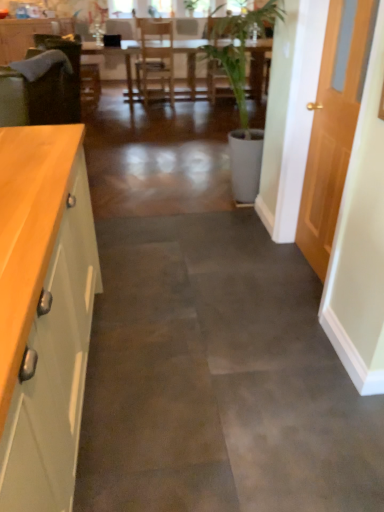
Describe the element at coordinates (117, 55) in the screenshot. This screenshot has height=512, width=384. I see `wooden table at center` at that location.

Find the location of `velvet green armchair at left`. velvet green armchair at left is located at coordinates (74, 70).

Locate an element on the screen. matte green cabinet at left, arranged as the first cabinetry when viewed from the back is located at coordinates (28, 35).

The height and width of the screenshot is (512, 384). Describe the element at coordinates (28, 35) in the screenshot. I see `matte green cabinet at left, which is the second cabinetry in front-to-back order` at that location.

Find the location of a particular element. The width and height of the screenshot is (384, 512). wooden table at center is located at coordinates (117, 55).

Is point (42, 37) positioned after point (41, 451)?

Yes, point (42, 37) is behind point (41, 451).

Identify the location of cabinetry in front of the velvet green armchair at left. The height and width of the screenshot is (512, 384). (44, 312).

Which object is wider, velvet green armchair at left or green matte cabinet at left, placed as the first cabinetry when sorted from front to back?

velvet green armchair at left.

Is matte green cabinet at left, placed as the second cabinetry when sorted from right to left, with wooden door at right?

They are not placed beside each other.

Does matte green cabinet at left, which is the second cabinetry in front-to-back order, have a lesser height compared to wooden door at right?

Correct, matte green cabinet at left, which is the second cabinetry in front-to-back order, is not as tall as wooden door at right.

Is matte green cabinet at left, arranged as the 1th cabinetry when viewed from the left, not within wooden door at right?

Absolutely, matte green cabinet at left, arranged as the 1th cabinetry when viewed from the left, is external to wooden door at right.

Is matte green cabinet at left, placed as the second cabinetry when sorted from right to left, aimed at wooden door at right?

Yes, matte green cabinet at left, placed as the second cabinetry when sorted from right to left, is oriented towards wooden door at right.

Is velvet green armchair at left at the back of matte green cabinet at left, which is the second cabinetry in front-to-back order?

matte green cabinet at left, which is the second cabinetry in front-to-back order, is not turned away from velvet green armchair at left.

Does matte green cabinet at left, arranged as the 1th cabinetry when viewed from the left, appear on the left side of velvet green armchair at left?

Yes.

Would you consider matte green cabinet at left, arranged as the 1th cabinetry when viewed from the left, to be distant from velvet green armchair at left?

matte green cabinet at left, arranged as the 1th cabinetry when viewed from the left, is near velvet green armchair at left, not far away.

Consider the image. Is velvet green armchair at left further to the viewer compared to wooden table at center?

No, velvet green armchair at left is closer to the camera.

Is velvet green armchair at left positioned far away from wooden table at center?

velvet green armchair at left is far away from wooden table at center.

Which is behind, point (53, 46) or point (137, 42)?

The point (137, 42) is farther from the camera.

Considering the relative sizes of green matte cabinet at left, the 1th cabinetry in the right-to-left sequence, and velvet green armchair at left in the image provided, is green matte cabinet at left, the 1th cabinetry in the right-to-left sequence, wider than velvet green armchair at left?

No.

Looking at the image, does green matte cabinet at left, the 2th cabinetry viewed from the left, seem bigger or smaller compared to velvet green armchair at left?

green matte cabinet at left, the 2th cabinetry viewed from the left, is bigger than velvet green armchair at left.

Between point (62, 194) and point (73, 64), which one is positioned in front?

The point (62, 194) is in front.

Consider the image. Which object is further away from the camera taking this photo, matte green cabinet at left, which is the second cabinetry in front-to-back order, or green matte cabinet at left, which is the first cabinetry in bottom-to-top order?

matte green cabinet at left, which is the second cabinetry in front-to-back order, is more distant.

Which object is positioned more to the right, matte green cabinet at left, the first cabinetry positioned from the top, or green matte cabinet at left, the second cabinetry from the back?

Positioned to the right is green matte cabinet at left, the second cabinetry from the back.

Does matte green cabinet at left, which ranks as the 2th cabinetry in bottom-to-top order, have a greater width compared to green matte cabinet at left, which is the first cabinetry in bottom-to-top order?

No, matte green cabinet at left, which ranks as the 2th cabinetry in bottom-to-top order, is not wider than green matte cabinet at left, which is the first cabinetry in bottom-to-top order.

Looking at this image, from the image's perspective, does matte green cabinet at left, arranged as the 1th cabinetry when viewed from the left, appear lower than green matte cabinet at left, the second cabinetry from the back?

No.

Can wooden door at right be found inside velvet green armchair at left?

Definitely not — wooden door at right is not inside velvet green armchair at left.

Who is more distant, velvet green armchair at left or wooden door at right?

velvet green armchair at left is further away from the camera.

You are a GUI agent. You are given a task and a screenshot of the screen. Output one action in this format:
    pyautogui.click(x=<x>, y=<y>)
    Task: Click on the armchair that appears behind the green matte cabinet at left, acting as the 2th cabinetry starting from the top
    Image resolution: width=384 pixels, height=512 pixels.
    Given the screenshot: What is the action you would take?
    pyautogui.click(x=74, y=70)

What are the coordinates of `door above the matte green cabinet at left, arranged as the first cabinetry when viewed from the back (from a real-world perspective)` in the screenshot? It's located at (334, 125).

Based on their spatial positions, is velvet green armchair at left or matte green cabinet at left, which is the second cabinetry in front-to-back order, closer to green matte cabinet at left, which is the first cabinetry in bottom-to-top order?

Among the two, velvet green armchair at left is located nearer to green matte cabinet at left, which is the first cabinetry in bottom-to-top order.

Looking at the image, which one is located further to wooden door at right, matte green cabinet at left, placed as the second cabinetry when sorted from right to left, or wooden table at center?

matte green cabinet at left, placed as the second cabinetry when sorted from right to left, is further to wooden door at right.

Considering their positions, is green matte cabinet at left, the 2th cabinetry viewed from the left, positioned further to velvet green armchair at left than wooden table at center?

green matte cabinet at left, the 2th cabinetry viewed from the left.

From the image, which object appears to be nearer to matte green cabinet at left, which is the second cabinetry in front-to-back order, velvet green armchair at left or wooden door at right?

velvet green armchair at left is positioned closer to the anchor matte green cabinet at left, which is the second cabinetry in front-to-back order.

From the image, which object appears to be farther from green matte cabinet at left, the 1th cabinetry in the right-to-left sequence, matte green cabinet at left, the first cabinetry positioned from the top, or wooden table at center?

wooden table at center lies further to green matte cabinet at left, the 1th cabinetry in the right-to-left sequence, than the other object.

When comparing their distances from wooden door at right, does wooden table at center or green matte cabinet at left, the second cabinetry from the back, seem further?

Based on the image, wooden table at center appears to be further to wooden door at right.

Which object lies further to the anchor point wooden table at center, wooden door at right or velvet green armchair at left?

wooden door at right is positioned further to the anchor wooden table at center.

From the image, which object appears to be nearer to velvet green armchair at left, matte green cabinet at left, arranged as the 1th cabinetry when viewed from the left, or green matte cabinet at left, the 1th cabinetry in the right-to-left sequence?

Among the two, matte green cabinet at left, arranged as the 1th cabinetry when viewed from the left, is located nearer to velvet green armchair at left.

This screenshot has width=384, height=512. What are the coordinates of `door between green matte cabinet at left, acting as the 2th cabinetry starting from the top, and velvet green armchair at left from front to back` in the screenshot? It's located at (334, 125).

The height and width of the screenshot is (512, 384). What are the coordinates of `armchair between wooden door at right and matte green cabinet at left, placed as the second cabinetry when sorted from right to left, along the z-axis` in the screenshot? It's located at (74, 70).

Locate an element on the screen. This screenshot has height=512, width=384. door between green matte cabinet at left, acting as the 2th cabinetry starting from the top, and wooden table at center in the front-back direction is located at coordinates (334, 125).

The image size is (384, 512). Find the location of `table between green matte cabinet at left, acting as the 2th cabinetry starting from the top, and matte green cabinet at left, arranged as the first cabinetry when viewed from the back, in the front-back direction`. table between green matte cabinet at left, acting as the 2th cabinetry starting from the top, and matte green cabinet at left, arranged as the first cabinetry when viewed from the back, in the front-back direction is located at coordinates (117, 55).